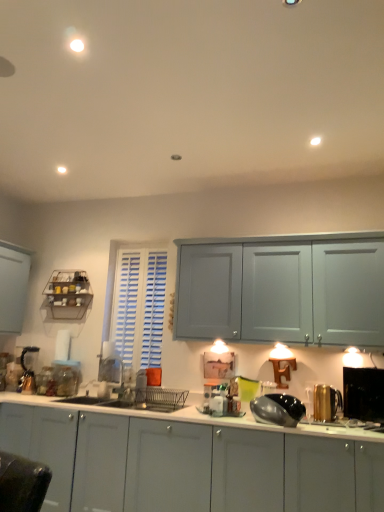
Where is `free space on the front side of black glossy toaster at right, marked as the fourth appliance in a back-to-front arrangement`? free space on the front side of black glossy toaster at right, marked as the fourth appliance in a back-to-front arrangement is located at coordinates (366, 431).